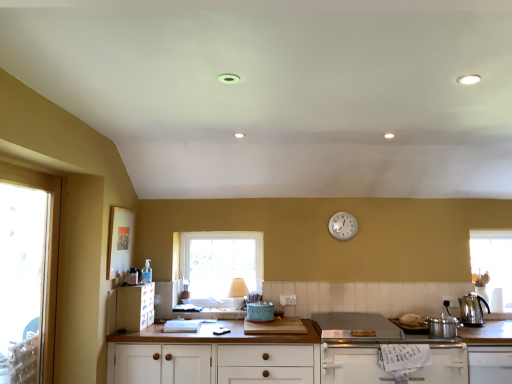
Question: Does metallic silver pot at right, which is counted as the 2th appliance, starting from the left, lie in front of transparent glass window at left, the 1th window when ordered from left to right?

Choices:
 (A) yes
 (B) no

Answer: (B)

Question: From the image's perspective, is metallic silver pot at right, placed as the 1th appliance when sorted from right to left, located beneath transparent glass window at left, the 1th window when ordered from left to right?

Choices:
 (A) no
 (B) yes

Answer: (B)

Question: Is metallic silver pot at right, placed as the 1th appliance when sorted from right to left, oriented towards transparent glass window at left, the 2th window positioned from the back?

Choices:
 (A) no
 (B) yes

Answer: (A)

Question: Is the surface of metallic silver pot at right, which ranks as the 1th appliance in front-to-back order, in direct contact with transparent glass window at left, the 1th window when ordered from left to right?

Choices:
 (A) yes
 (B) no

Answer: (B)

Question: Can we say metallic silver pot at right, placed as the 1th appliance when sorted from right to left, lies outside transparent glass window at left, the 1th window when ordered from left to right?

Choices:
 (A) yes
 (B) no

Answer: (A)

Question: Do you think matte plastic cabinet at lower left, the first cabinetry positioned from the left, is within white matte cabinet at lower right, placed as the third cabinetry when sorted from left to right, or outside of it?

Choices:
 (A) outside
 (B) inside

Answer: (A)

Question: In the image, is matte plastic cabinet at lower left, the first cabinetry positioned from the left, positioned in front of or behind white matte cabinet at lower right, placed as the third cabinetry when sorted from left to right?

Choices:
 (A) behind
 (B) front

Answer: (A)

Question: From the image's perspective, is matte plastic cabinet at lower left, marked as the 4th cabinetry in a right-to-left arrangement, positioned above or below white matte cabinet at lower right, placed as the third cabinetry when sorted from left to right?

Choices:
 (A) below
 (B) above

Answer: (B)

Question: In terms of height, does matte plastic cabinet at lower left, marked as the 4th cabinetry in a right-to-left arrangement, look taller or shorter compared to white matte cabinet at lower right, which is counted as the second cabinetry, starting from the right?

Choices:
 (A) short
 (B) tall

Answer: (A)

Question: Is transparent glass window at left, arranged as the 2th window when viewed from the right, wider or thinner than clear glass window at center, which is the 2th window from front to back?

Choices:
 (A) thin
 (B) wide

Answer: (B)

Question: Which is correct: transparent glass window at left, arranged as the 2th window when viewed from the right, is inside clear glass window at center, which appears as the second window when viewed from the left, or outside of it?

Choices:
 (A) outside
 (B) inside

Answer: (A)

Question: From the image's perspective, is transparent glass window at left, the 1th window when ordered from left to right, positioned above or below clear glass window at center, the first window from the right?

Choices:
 (A) below
 (B) above

Answer: (B)

Question: From a real-world perspective, is transparent glass window at left, which is the 1th window in front-to-back order, above or below clear glass window at center, which appears as the second window when viewed from the left?

Choices:
 (A) above
 (B) below

Answer: (A)

Question: Considering the positions of stainless steel kettle at right and white matte cabinet at lower right, placed as the third cabinetry when sorted from left to right, in the image, is stainless steel kettle at right bigger or smaller than white matte cabinet at lower right, placed as the third cabinetry when sorted from left to right,?

Choices:
 (A) big
 (B) small

Answer: (B)

Question: From a real-world perspective, is stainless steel kettle at right physically located above or below white matte cabinet at lower right, which is counted as the second cabinetry, starting from the right?

Choices:
 (A) above
 (B) below

Answer: (A)